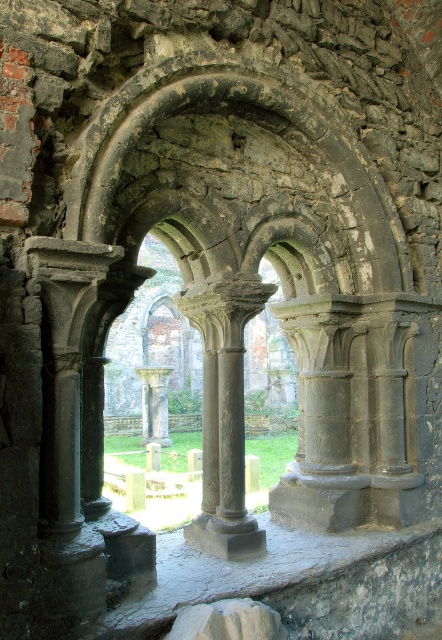
Does smooth gray stone column at center appear under gray stone column at center?

No.

Between point (213, 508) and point (156, 413), which one is positioned behind?

Positioned behind is point (156, 413).

Who is more distant from viewer, (240, 435) or (163, 371)?

Positioned behind is point (163, 371).

What are the coordinates of `smooth gray stone column at center` in the screenshot? It's located at (224, 416).